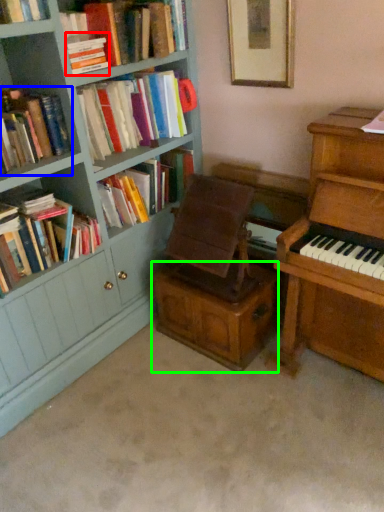
Question: Estimate the real-world distances between objects in this image. Which object is closer to book (highlighted by a red box), book (highlighted by a blue box) or drawer (highlighted by a green box)?

Choices:
 (A) book
 (B) drawer

Answer: (A)